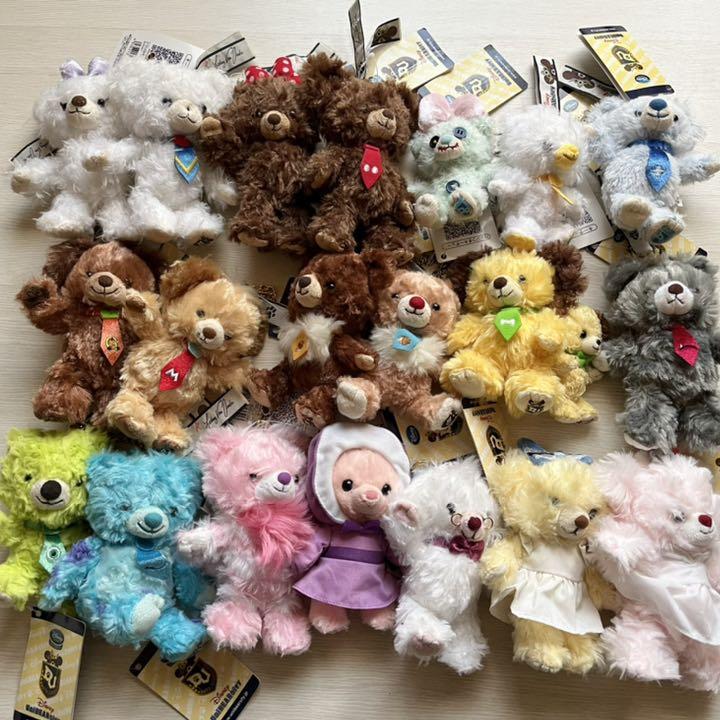
Where is `white stuffed bears`? white stuffed bears is located at coordinates (427, 535), (538, 163), (165, 148), (86, 150).